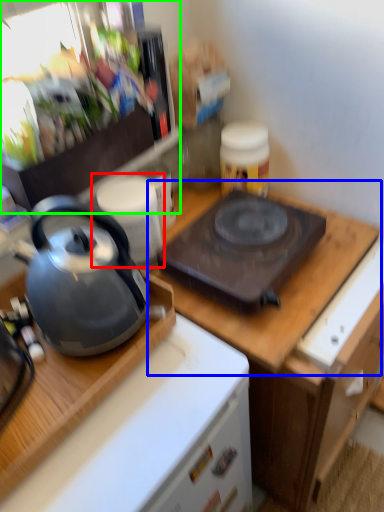
Question: Which object is positioned closest to appliance (highlighted by a red box)? Select from counter top (highlighted by a blue box) and appliance (highlighted by a green box).

Choices:
 (A) counter top
 (B) appliance

Answer: (B)